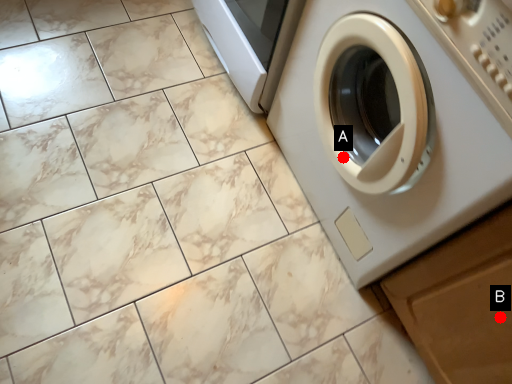
Question: Two points are circled on the image, labeled by A and B beside each circle. Which point is closer to the camera?

Choices:
 (A) A is closer
 (B) B is closer

Answer: (B)